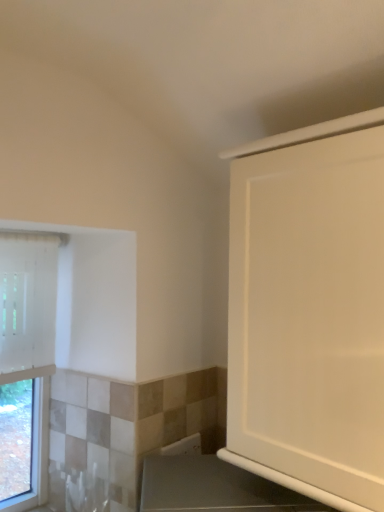
This screenshot has width=384, height=512. Describe the element at coordinates (26, 365) in the screenshot. I see `white fabric window at left` at that location.

This screenshot has height=512, width=384. Find the location of `white fabric window at left`. white fabric window at left is located at coordinates (26, 365).

What is the approximate width of white fabric window at left?

The width of white fabric window at left is 3.76 inches.

I want to click on white glossy cabinet at upper right, so click(309, 315).

This screenshot has height=512, width=384. What do you see at coordinates (309, 315) in the screenshot?
I see `white glossy cabinet at upper right` at bounding box center [309, 315].

Image resolution: width=384 pixels, height=512 pixels. Identify the location of white fabric window at left. (26, 365).

Between white glossy cabinet at upper right and white fabric window at left, which one appears on the right side from the viewer's perspective?

white glossy cabinet at upper right.

Is white glossy cabinet at upper right positioned before white fabric window at left?

Yes, it is.

Which is behind, point (320, 285) or point (26, 301)?

Positioned behind is point (26, 301).

From the image's perspective, is white glossy cabinet at upper right located above white fabric window at left?

Yes.

From a real-world perspective, is white glossy cabinet at upper right above or below white fabric window at left?

In terms of real-world spatial position, white glossy cabinet at upper right is above white fabric window at left.

Considering the sizes of white glossy cabinet at upper right and white fabric window at left in the image, is white glossy cabinet at upper right wider or thinner than white fabric window at left?

white glossy cabinet at upper right is wider than white fabric window at left.

Does white glossy cabinet at upper right have a lesser height compared to white fabric window at left?

Indeed, white glossy cabinet at upper right has a lesser height compared to white fabric window at left.

Can you confirm if white glossy cabinet at upper right is smaller than white fabric window at left?

Incorrect, white glossy cabinet at upper right is not smaller in size than white fabric window at left.

Choose the correct answer: Is white glossy cabinet at upper right inside white fabric window at left or outside it?

white glossy cabinet at upper right is spatially situated outside white fabric window at left.

Are white glossy cabinet at upper right and white fabric window at left beside each other?

No.

Could you tell me if white glossy cabinet at upper right is turned towards white fabric window at left?

No, white glossy cabinet at upper right is not aimed at white fabric window at left.

Can you tell me how much white glossy cabinet at upper right and white fabric window at left differ in facing direction?

The angular difference between white glossy cabinet at upper right and white fabric window at left is 91.3 degrees.

I want to click on screen door above the white fabric window at left (from the image's perspective), so click(309, 315).

Considering the relative positions of white fabric window at left and white glossy cabinet at upper right in the image provided, is white fabric window at left to the left of white glossy cabinet at upper right from the viewer's perspective?

Yes.

Which is in front, white fabric window at left or white glossy cabinet at upper right?

white glossy cabinet at upper right is more forward.

Which is farther, (x=22, y=298) or (x=250, y=439)?

The point (x=22, y=298) is behind.

From the image's perspective, is white fabric window at left below white glossy cabinet at upper right?

Yes, from the image's perspective, white fabric window at left is beneath white glossy cabinet at upper right.

From a real-world perspective, between white fabric window at left and white glossy cabinet at upper right, who is vertically higher?

In real-world perspective, white glossy cabinet at upper right is above.

Considering the sizes of white fabric window at left and white glossy cabinet at upper right in the image, is white fabric window at left wider or thinner than white glossy cabinet at upper right?

In the image, white fabric window at left appears to be more narrow than white glossy cabinet at upper right.

In terms of height, does white fabric window at left look taller or shorter compared to white glossy cabinet at upper right?

Considering their sizes, white fabric window at left has more height than white glossy cabinet at upper right.

Considering the sizes of objects white fabric window at left and white glossy cabinet at upper right in the image provided, who is smaller, white fabric window at left or white glossy cabinet at upper right?

Smaller between the two is white fabric window at left.

Would you say white fabric window at left is inside or outside white glossy cabinet at upper right?

white fabric window at left is located beyond the bounds of white glossy cabinet at upper right.

Is white fabric window at left placed right next to white glossy cabinet at upper right?

No, white fabric window at left is not making contact with white glossy cabinet at upper right.

Is white fabric window at left turned away from white glossy cabinet at upper right?

No, white fabric window at left's orientation is not away from white glossy cabinet at upper right.

How much distance is there between white fabric window at left and white glossy cabinet at upper right?

Result: The distance of white fabric window at left from white glossy cabinet at upper right is 3.73 meters.

You are a GUI agent. You are given a task and a screenshot of the screen. Output one action in this format:
    pyautogui.click(x=<x>, y=<y>)
    Task: Click on the screen door above the white fabric window at left (from a real-world perspective)
    The image size is (384, 512).
    Given the screenshot: What is the action you would take?
    pyautogui.click(x=309, y=315)

This screenshot has height=512, width=384. Identify the location of screen door on the right of white fabric window at left. (309, 315).

In the image, there is a white fabric window at left. At what (x,y) coordinates should I click in order to perform the action: click on screen door above it (from the image's perspective). Please return your answer as a coordinate pair (x, y). The height and width of the screenshot is (512, 384). Looking at the image, I should click on (309, 315).